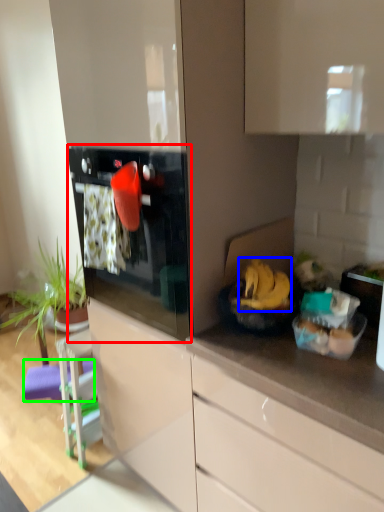
Question: Estimate the real-world distances between objects in this image. Which object is closer to oven (highlighted by a red box), banana (highlighted by a blue box) or bar stool (highlighted by a green box)?

Choices:
 (A) banana
 (B) bar stool

Answer: (A)